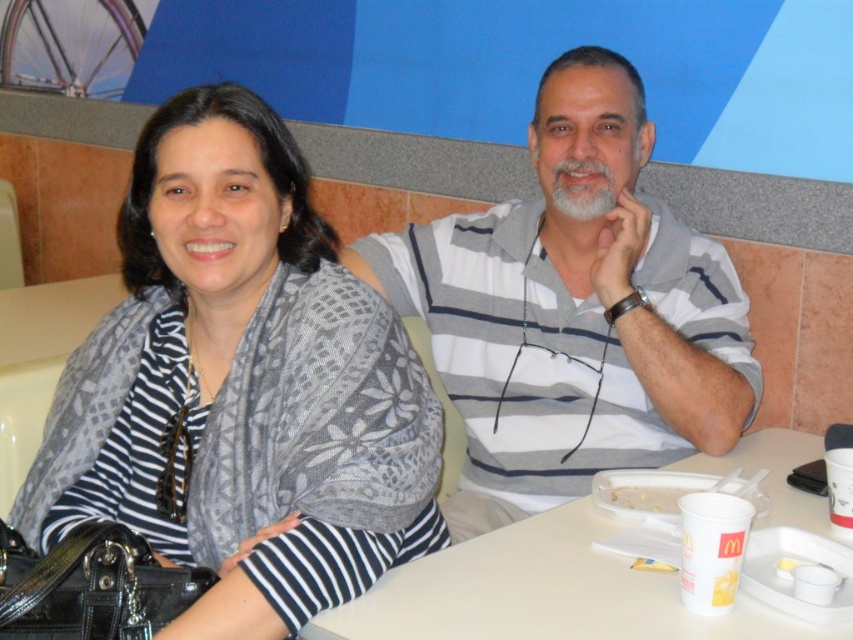
Is white plastic tray at lower center positioned before white paper tray at lower center?

Yes, it is in front of white paper tray at lower center.

Based on the photo, is white plastic tray at lower center to the left of white paper tray at lower center from the viewer's perspective?

Incorrect, white plastic tray at lower center is not on the left side of white paper tray at lower center.

Is point (799, 508) positioned behind point (625, 500)?

Yes, point (799, 508) is farther from viewer.

Identify the location of white plastic tray at lower center. (544, 593).

Is striped fabric scarf at left wider than white paper tray at lower center?

Result: Correct, the width of striped fabric scarf at left exceeds that of white paper tray at lower center.

Does striped fabric scarf at left have a smaller size compared to white paper tray at lower center?

Incorrect, striped fabric scarf at left is not smaller in size than white paper tray at lower center.

Identify the location of striped fabric scarf at left. (241, 385).

Does striped fabric scarf at left appear under gray striped shirt at center?

Yes.

Measure the distance between striped fabric scarf at left and camera.

The distance of striped fabric scarf at left from camera is 3.37 feet.

What do you see at coordinates (241, 385) in the screenshot? I see `striped fabric scarf at left` at bounding box center [241, 385].

Identify the location of striped fabric scarf at left. This screenshot has height=640, width=853. [241, 385].